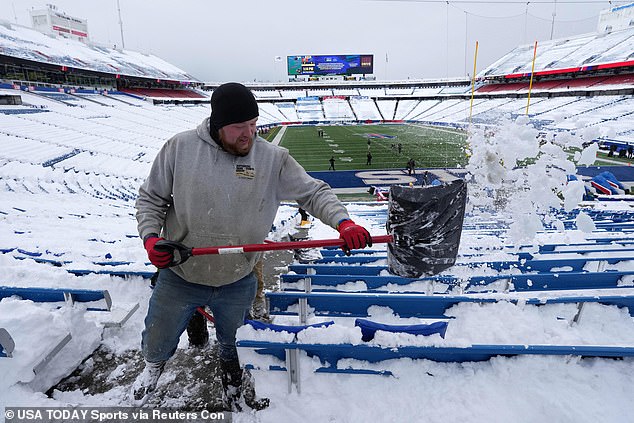
The image size is (634, 423). Identify the location of chair. (440, 308).